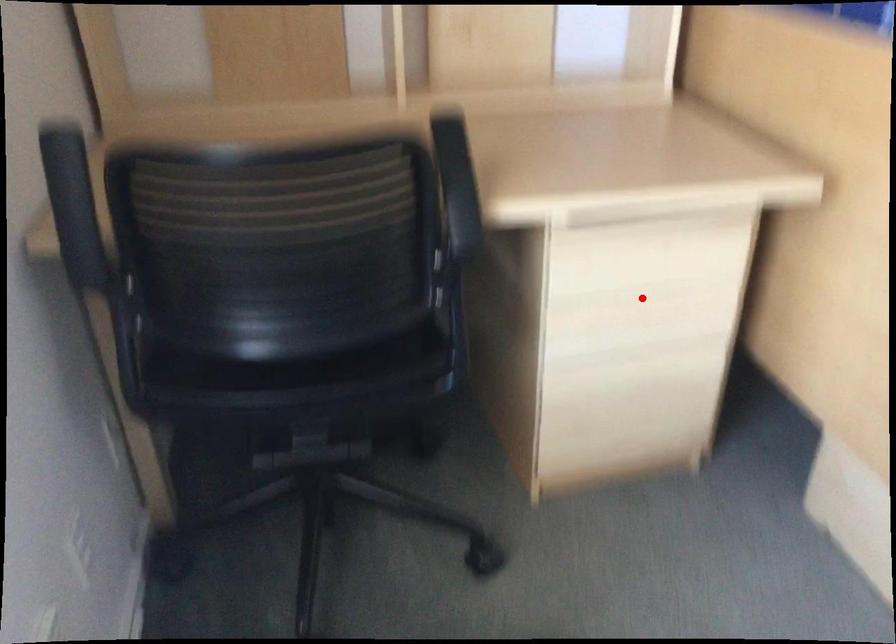
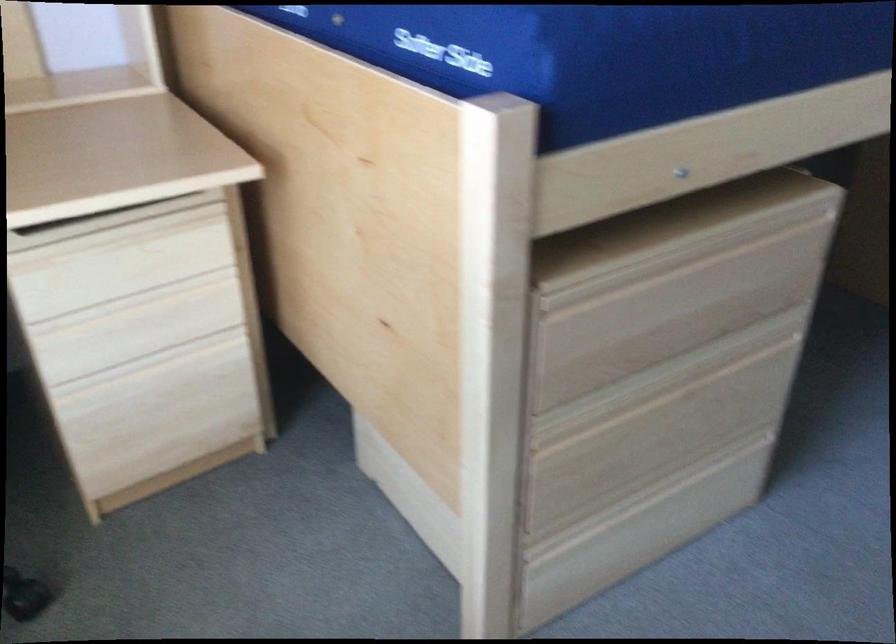
In the second image, find the point that corresponds to the highlighted location in the first image.

(134, 301)